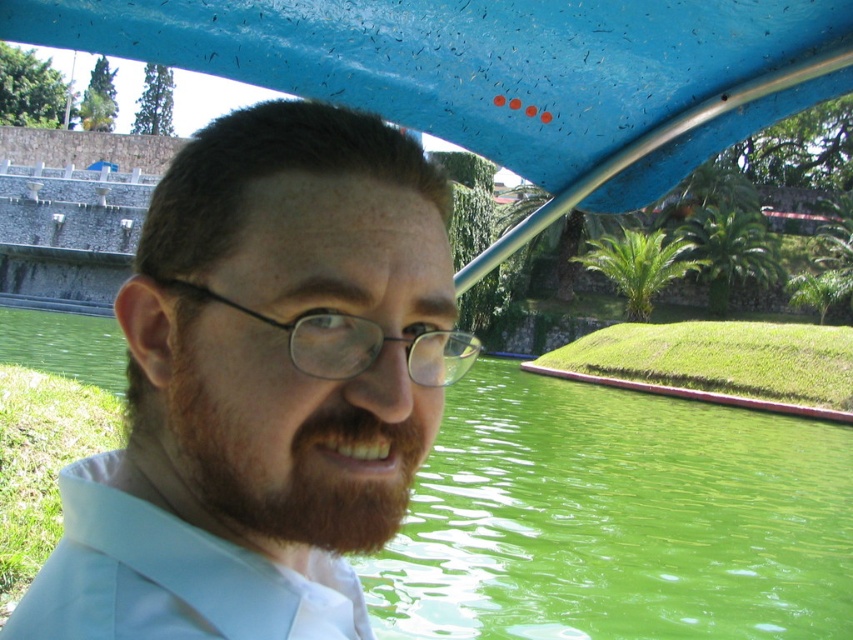
Question: Is reddish-brown hair at center smaller than black plastic glasses at center?

Choices:
 (A) no
 (B) yes

Answer: (B)

Question: Which object is positioned farthest from the black plastic glasses at center?

Choices:
 (A) reddish-brown hair at center
 (B) green liquid water at center

Answer: (B)

Question: Is green liquid water at center below reddish-brown hair at center?

Choices:
 (A) no
 (B) yes

Answer: (B)

Question: Among these points, which one is farthest from the camera?

Choices:
 (A) coord(427,378)
 (B) coord(47,314)
 (C) coord(108,470)

Answer: (B)

Question: Does green liquid water at center appear under black plastic glasses at center?

Choices:
 (A) yes
 (B) no

Answer: (A)

Question: Based on their relative distances, which object is nearer to the green liquid water at center?

Choices:
 (A) reddish-brown hair at center
 (B) black plastic glasses at center
 (C) matte blue shirt at center

Answer: (A)